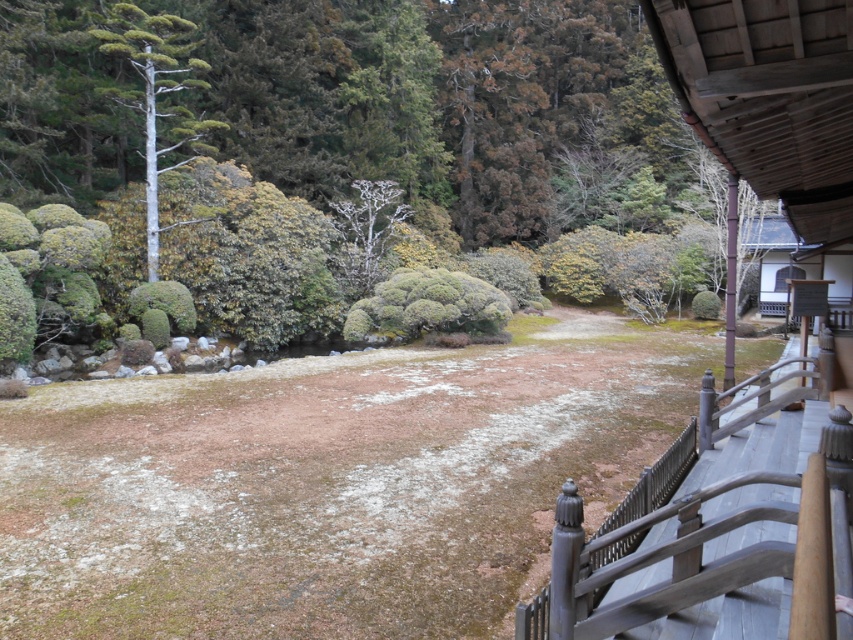
Is white smooth tree at upper left thinner than green textured bush at center?

In fact, white smooth tree at upper left might be wider than green textured bush at center.

Is white smooth tree at upper left closer to camera compared to green textured bush at center?

Yes, it is.

Identify the location of white smooth tree at upper left. This screenshot has height=640, width=853. [158, 96].

Find the location of a particular element. Image resolution: width=853 pixels, height=640 pixels. white smooth tree at upper left is located at coordinates (158, 96).

Is brown wooden hut at upper right positioned at the back of bare white tree at center?

No, it is in front of bare white tree at center.

Can you confirm if brown wooden hut at upper right is bigger than bare white tree at center?

Indeed, brown wooden hut at upper right has a larger size compared to bare white tree at center.

Which is behind, point (817, 106) or point (350, 256)?

Positioned behind is point (350, 256).

You are a GUI agent. You are given a task and a screenshot of the screen. Output one action in this format:
    pyautogui.click(x=<x>, y=<y>)
    Task: Click on the brown wooden hut at upper right
    
    Given the screenshot: What is the action you would take?
    pyautogui.click(x=769, y=97)

Is brown wooden hut at upper right positioned behind white smooth tree at upper left?

No, brown wooden hut at upper right is closer to the viewer.

Looking at this image, who is higher up, brown wooden hut at upper right or white smooth tree at upper left?

white smooth tree at upper left

The height and width of the screenshot is (640, 853). In order to click on brown wooden hut at upper right in this screenshot , I will do `click(769, 97)`.